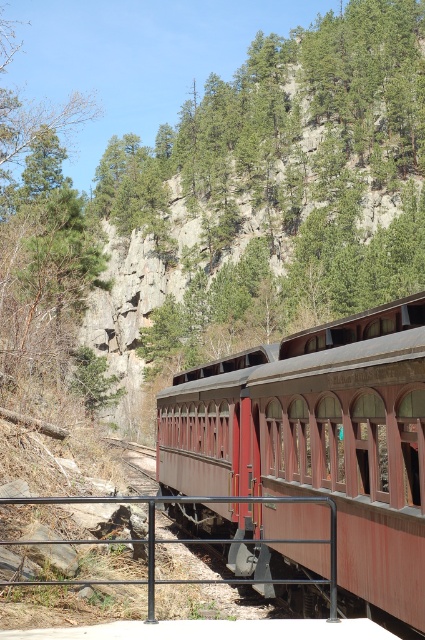
Does matte red train car at center appear under black metal rail at lower center?

Yes, matte red train car at center is below black metal rail at lower center.

Does matte red train car at center have a greater width compared to black metal rail at lower center?

Correct, the width of matte red train car at center exceeds that of black metal rail at lower center.

Is point (231, 364) positioned before point (212, 580)?

No.

Where is `matte red train car at center`? Image resolution: width=425 pixels, height=640 pixels. matte red train car at center is located at coordinates (320, 442).